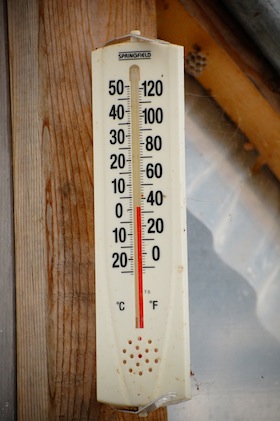
What are the coordinates of `unfinished wooden beam` in the screenshot? It's located at (80, 198), (74, 353), (77, 401), (74, 31), (26, 57), (33, 209), (31, 343).